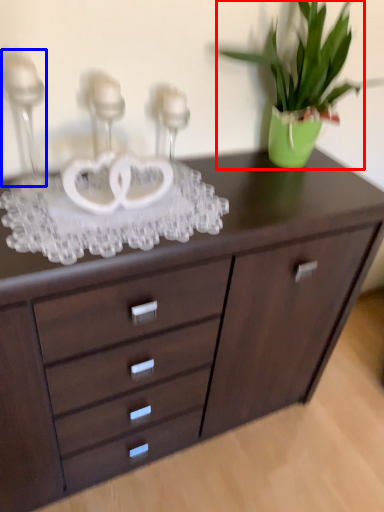
Question: Which object is further to the camera taking this photo, houseplant (highlighted by a red box) or candle holder (highlighted by a blue box)?

Choices:
 (A) houseplant
 (B) candle holder

Answer: (A)